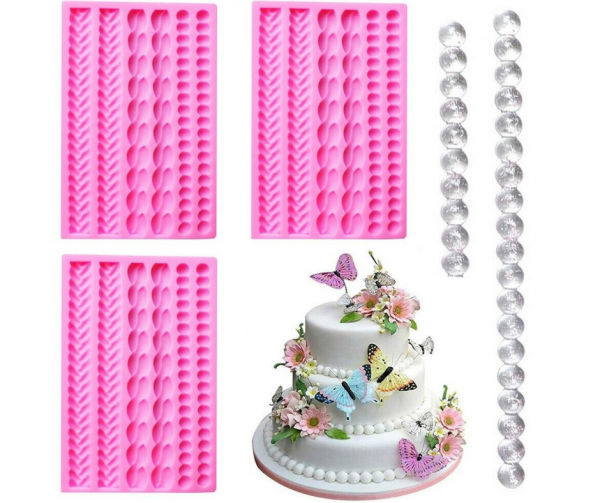
Image resolution: width=600 pixels, height=503 pixels. I want to click on decorating forms, so click(x=123, y=368), click(x=144, y=57), click(x=316, y=125), click(x=149, y=95).